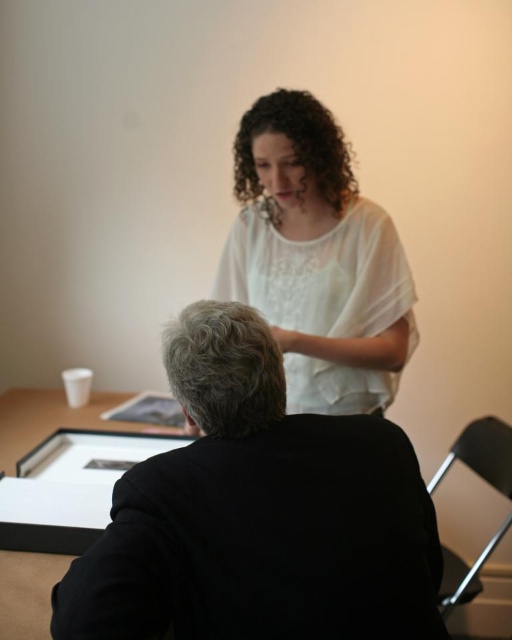
Can you confirm if gray curly hair at center is positioned below curly brown hair at upper center?

Correct, gray curly hair at center is located below curly brown hair at upper center.

Which of these two, gray curly hair at center or curly brown hair at upper center, stands shorter?

gray curly hair at center

Describe the element at coordinates (224, 369) in the screenshot. I see `gray curly hair at center` at that location.

Identify the location of gray curly hair at center. (224, 369).

Consider the image. Which is above, black matte jacket at lower center or white sheer blouse at upper center?

white sheer blouse at upper center

Which of these two, black matte jacket at lower center or white sheer blouse at upper center, stands taller?

With more height is white sheer blouse at upper center.

Is point (358, 486) positioned before point (353, 276)?

Yes, point (358, 486) is in front of point (353, 276).

What are the coordinates of `black matte jacket at lower center` in the screenshot? It's located at (259, 513).

Is point (273, 97) farther from viewer compared to point (181, 381)?

That is True.

Who is positioned more to the right, white sheer blouse at upper center or gray curly hair at center?

From the viewer's perspective, white sheer blouse at upper center appears more on the right side.

Is point (247, 273) closer to viewer compared to point (226, 435)?

No, it is behind (226, 435).

Where is `white sheer blouse at upper center`? white sheer blouse at upper center is located at coordinates (316, 259).